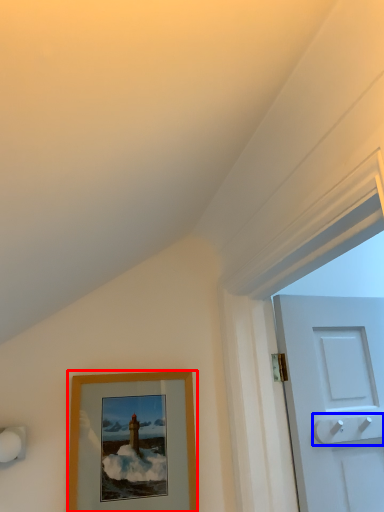
Question: Which point is closer to the camera, picture frame (highlighted by a red box) or door handle (highlighted by a blue box)?

Choices:
 (A) picture frame
 (B) door handle

Answer: (A)